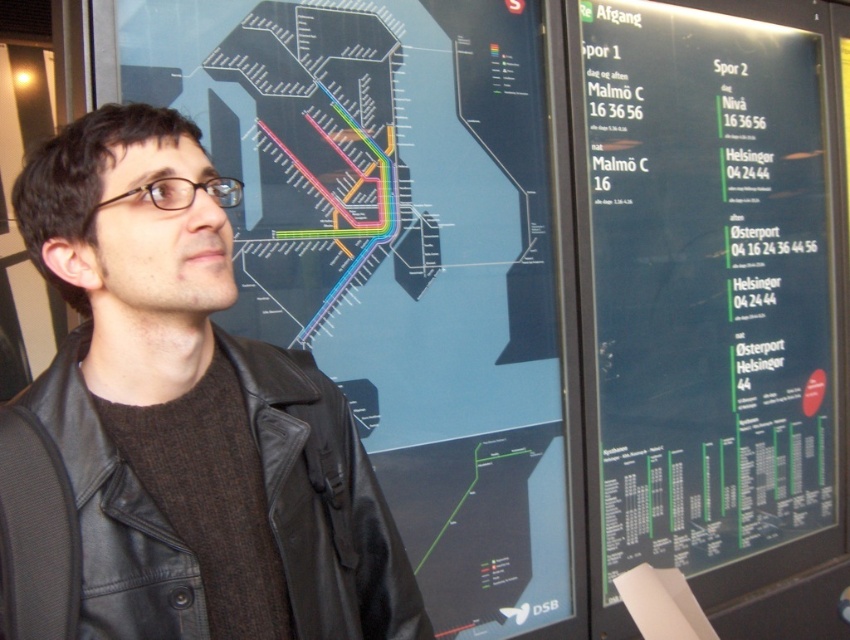
You are standing in front of the train schedule and map display board. You notice a specific point on the board at coordinates point (225, 113). If you want to touch this point with your hand, which direction should you move your hand relative to your current position?

The point (225, 113) is located at the lower left section of the display board. Since the distance from the camera is 5.41 feet, you should extend your hand forward towards the display board and move it slightly to the lower left to reach the point.